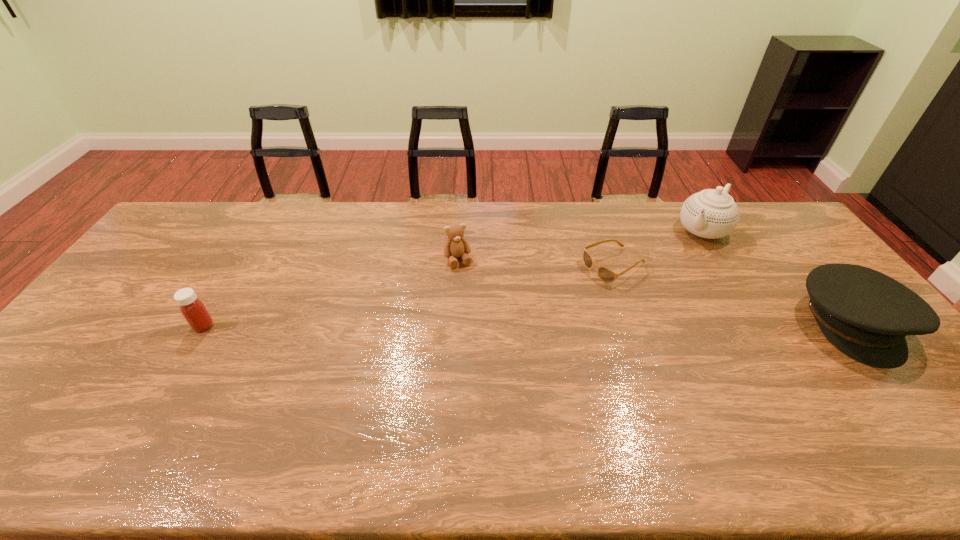
This screenshot has height=540, width=960. I want to click on vacant spot on the desktop that is between the medicine and the beret and is positioned on the front-facing side of the shortest object, so click(493, 325).

In order to click on vacant space on the desktop that is between the leftmost object and the beret and is positioned on the front-facing side of the fourth object from right to left in this screenshot , I will do `click(484, 325)`.

At what (x,y) coordinates should I click in order to perform the action: click on free spot on the desktop that is between the leftmost object and the beret and is positioned on the spout of the tallest object. Please return your answer as a coordinate pair (x, y). The image size is (960, 540). Looking at the image, I should click on (616, 325).